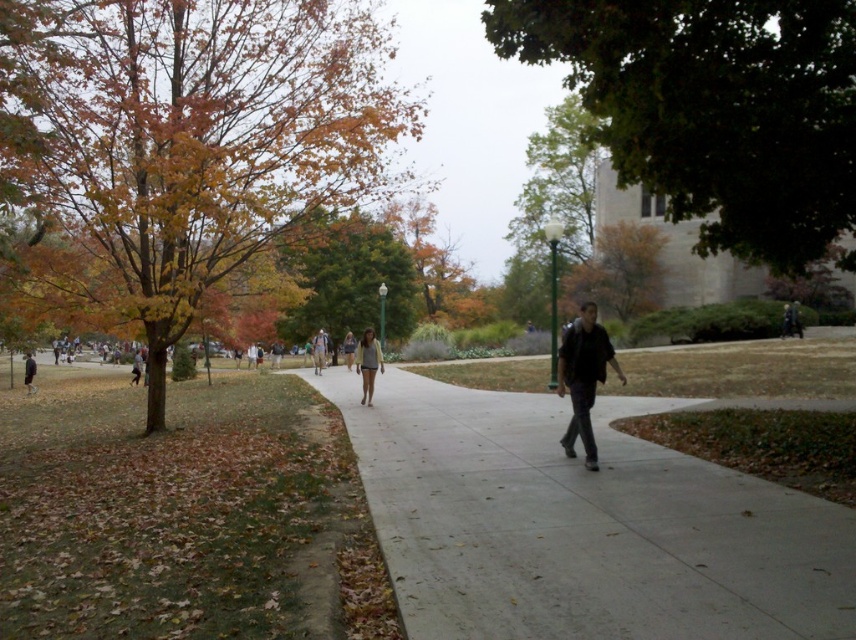
Looking at this image, is autumn leaves at left to the right of dark brown leather jacket at center from the viewer's perspective?

No, autumn leaves at left is not to the right of dark brown leather jacket at center.

Does autumn leaves at left have a smaller size compared to dark brown leather jacket at center?

Actually, autumn leaves at left might be larger than dark brown leather jacket at center.

Between point (244, 220) and point (608, 349), which one is positioned behind?

The point (244, 220) is more distant.

Find the location of a particular element. The image size is (856, 640). autumn leaves at left is located at coordinates pos(193,134).

Does green leafy tree at upper right have a lesser width compared to green leafy tree at center?

No.

Locate an element on the screen. This screenshot has height=640, width=856. green leafy tree at upper right is located at coordinates (712, 108).

Locate an element on the screen. The height and width of the screenshot is (640, 856). green leafy tree at upper right is located at coordinates (712, 108).

Locate an element on the screen. Image resolution: width=856 pixels, height=640 pixels. green leafy tree at upper right is located at coordinates (712, 108).

Between point (248, 150) and point (381, 356), which one is positioned in front?

Point (248, 150)

Between point (27, 51) and point (377, 365), which one is positioned behind?

The point (377, 365) is more distant.

Locate an element on the screen. The image size is (856, 640). autumn leaves at left is located at coordinates (193, 134).